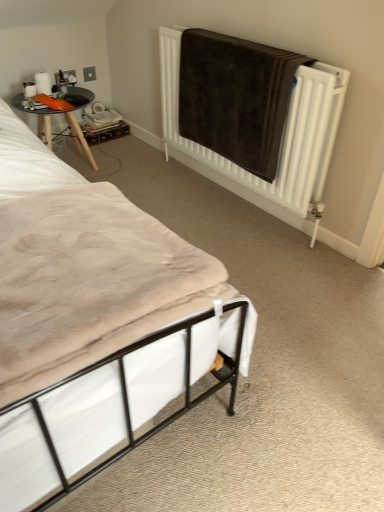
Question: Is white fabric bed at lower left inside wooden table at left?

Choices:
 (A) yes
 (B) no

Answer: (B)

Question: Is wooden table at left smaller than white fabric bed at lower left?

Choices:
 (A) no
 (B) yes

Answer: (B)

Question: From the image's perspective, is wooden table at left beneath white fabric bed at lower left?

Choices:
 (A) yes
 (B) no

Answer: (B)

Question: Does wooden table at left have a greater height compared to white fabric bed at lower left?

Choices:
 (A) yes
 (B) no

Answer: (A)

Question: Is wooden table at left not within white fabric bed at lower left?

Choices:
 (A) yes
 (B) no

Answer: (A)

Question: Is white fabric bed at lower left in front of or behind beige fabric mattress at lower left in the image?

Choices:
 (A) front
 (B) behind

Answer: (B)

Question: In terms of size, does white fabric bed at lower left appear bigger or smaller than beige fabric mattress at lower left?

Choices:
 (A) big
 (B) small

Answer: (A)

Question: Is white fabric bed at lower left inside the boundaries of beige fabric mattress at lower left, or outside?

Choices:
 (A) inside
 (B) outside

Answer: (B)

Question: From the image's perspective, is white fabric bed at lower left located above or below beige fabric mattress at lower left?

Choices:
 (A) below
 (B) above

Answer: (B)

Question: Is wooden table at left spatially inside beige fabric mattress at lower left, or outside of it?

Choices:
 (A) outside
 (B) inside

Answer: (A)

Question: In terms of height, does wooden table at left look taller or shorter compared to beige fabric mattress at lower left?

Choices:
 (A) tall
 (B) short

Answer: (A)

Question: Visually, is wooden table at left positioned to the left or to the right of beige fabric mattress at lower left?

Choices:
 (A) left
 (B) right

Answer: (A)

Question: Looking at their shapes, would you say wooden table at left is wider or thinner than beige fabric mattress at lower left?

Choices:
 (A) wide
 (B) thin

Answer: (B)

Question: Which is correct: brown towel at upper right is inside wooden table at left, or outside of it?

Choices:
 (A) outside
 (B) inside

Answer: (A)

Question: Looking at their shapes, would you say brown towel at upper right is wider or thinner than wooden table at left?

Choices:
 (A) wide
 (B) thin

Answer: (B)